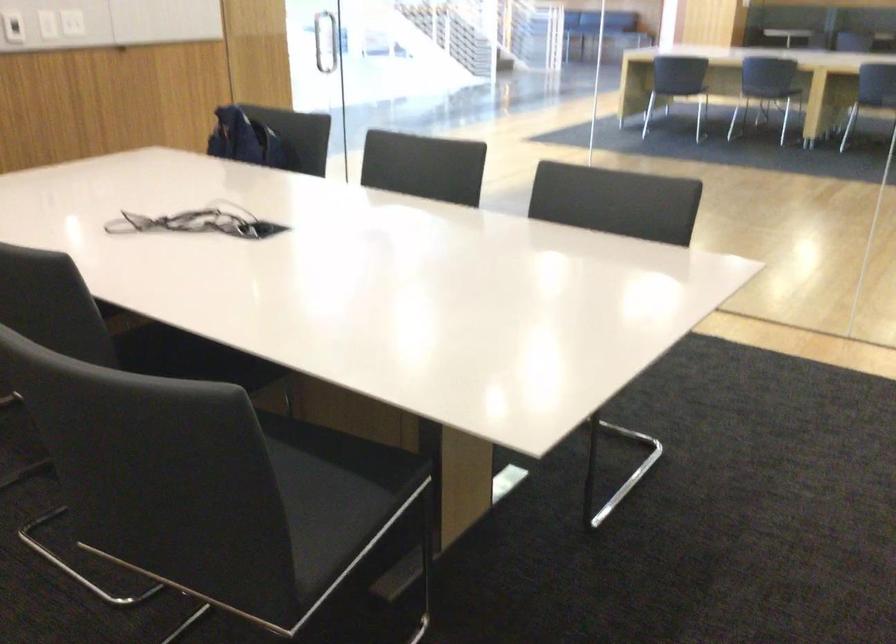
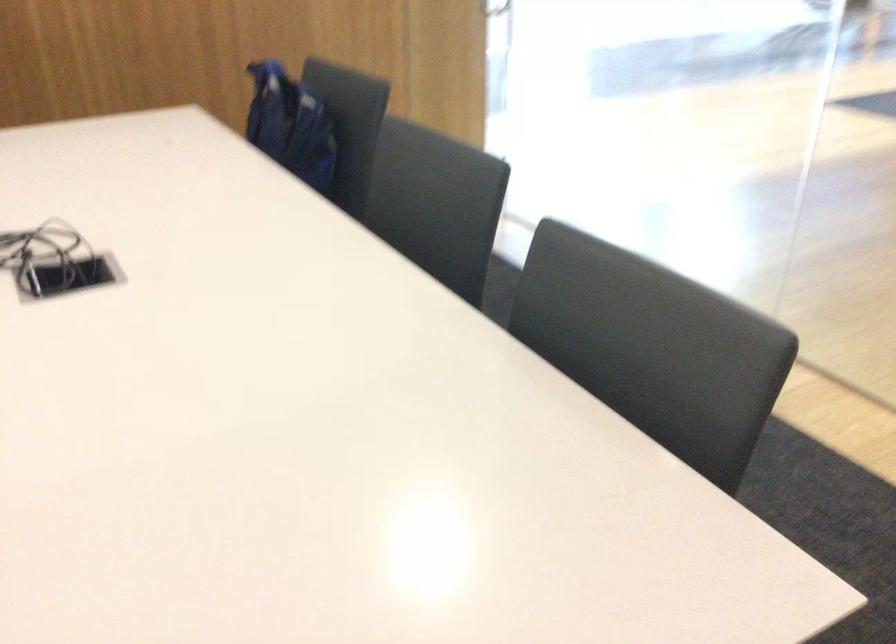
The images are taken continuously from a first-person perspective. In which direction are you moving?

The movement direction of the cameraman is right, forward.